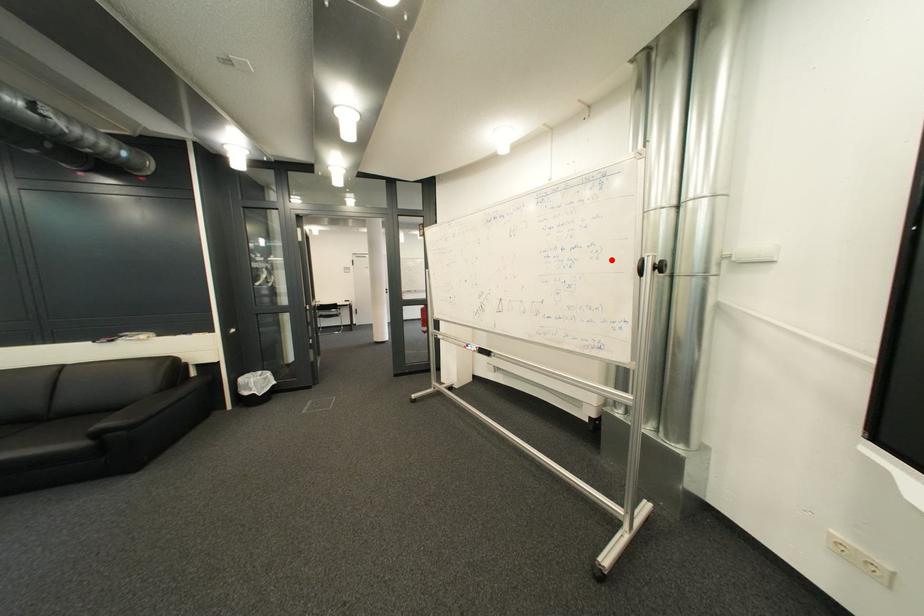
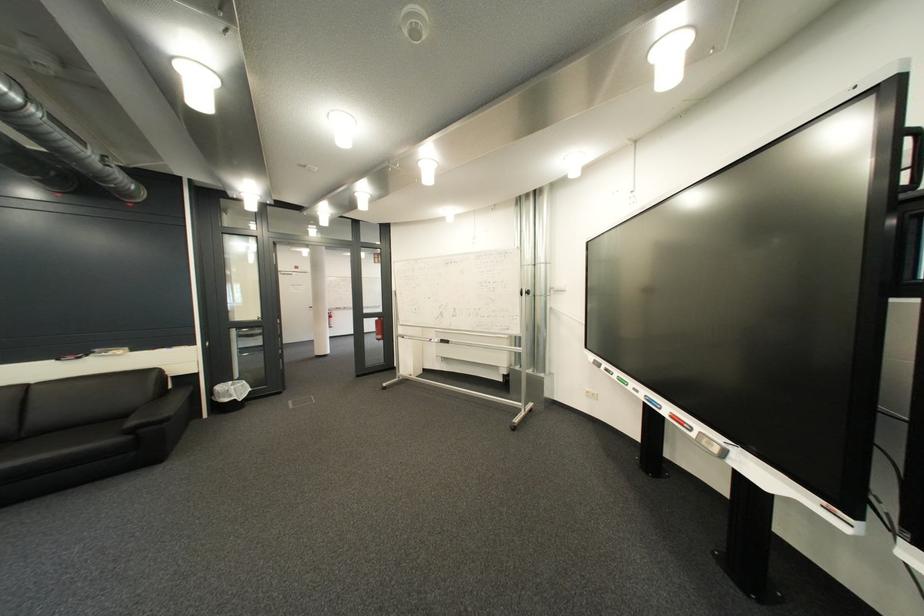
In the second image, find the point that corresponds to the highlighted location in the first image.

(518, 290)